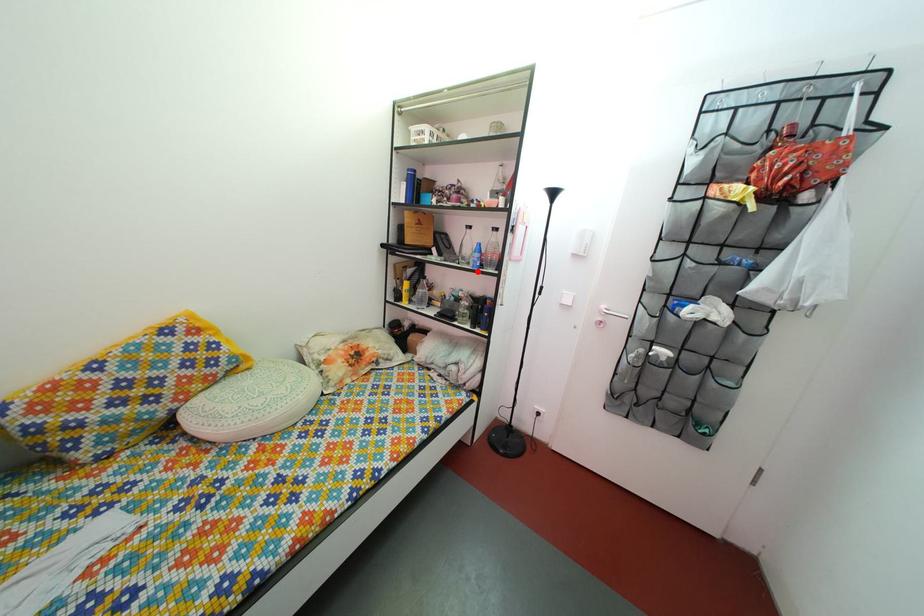
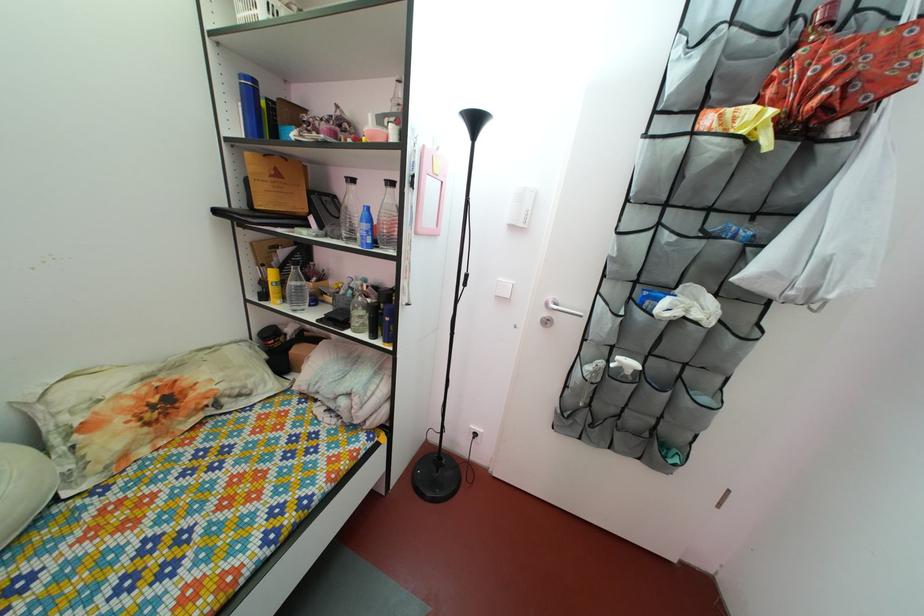
Locate, in the second image, the point that corresponds to the highlighted location in the first image.

(363, 248)